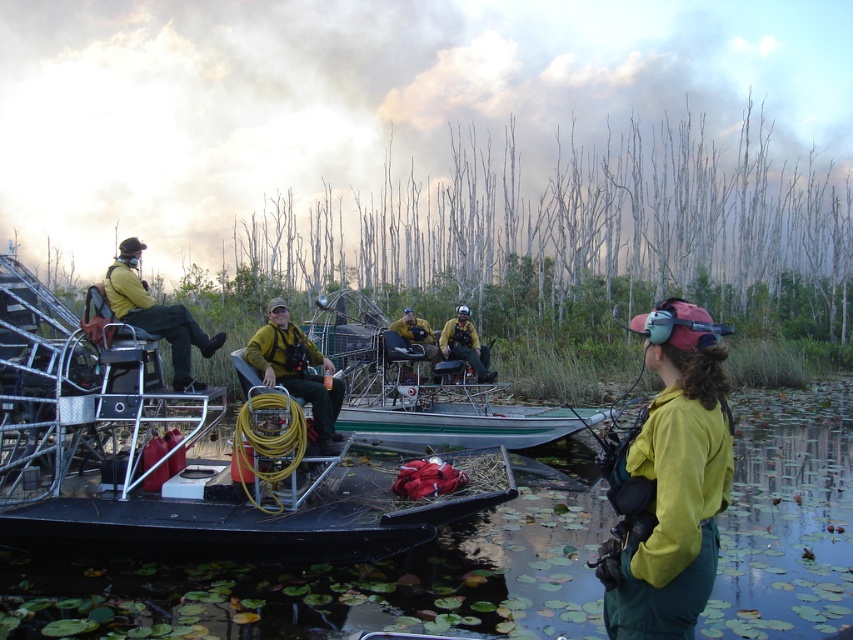
The width and height of the screenshot is (853, 640). Describe the element at coordinates (669, 481) in the screenshot. I see `yellow matte jacket at center` at that location.

Is yellow matte jacket at center shorter than yellow matte uniform at center?

No.

What do you see at coordinates (669, 481) in the screenshot? Image resolution: width=853 pixels, height=640 pixels. I see `yellow matte jacket at center` at bounding box center [669, 481].

Image resolution: width=853 pixels, height=640 pixels. I want to click on yellow matte jacket at center, so click(x=669, y=481).

Who is more forward, (329,422) or (456,310)?

Point (329,422) is in front.

Consider the image. Does yellow matte uniform at center have a lesser height compared to yellow fire-resistant suit at center?

No, yellow matte uniform at center is not shorter than yellow fire-resistant suit at center.

What do you see at coordinates (296, 369) in the screenshot?
I see `yellow matte uniform at center` at bounding box center [296, 369].

Locate an element on the screen. The width and height of the screenshot is (853, 640). yellow matte uniform at center is located at coordinates (296, 369).

Is transparent water at boat front taller than yellow matte jacket at center?

No.

From the picture: Which is below, transparent water at boat front or yellow matte jacket at center?

Positioned lower is transparent water at boat front.

Where is `transparent water at boat front`? transparent water at boat front is located at coordinates (347, 579).